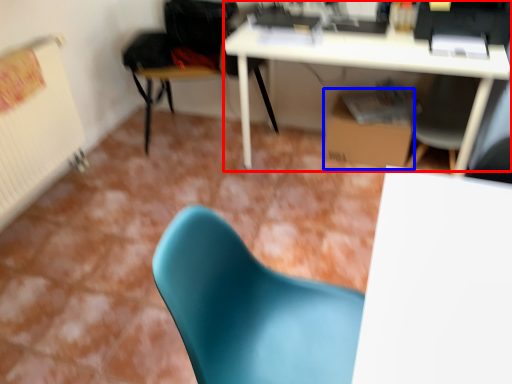
Question: Which object is further to the camera taking this photo, desk (highlighted by a red box) or cardboard box (highlighted by a blue box)?

Choices:
 (A) desk
 (B) cardboard box

Answer: (B)